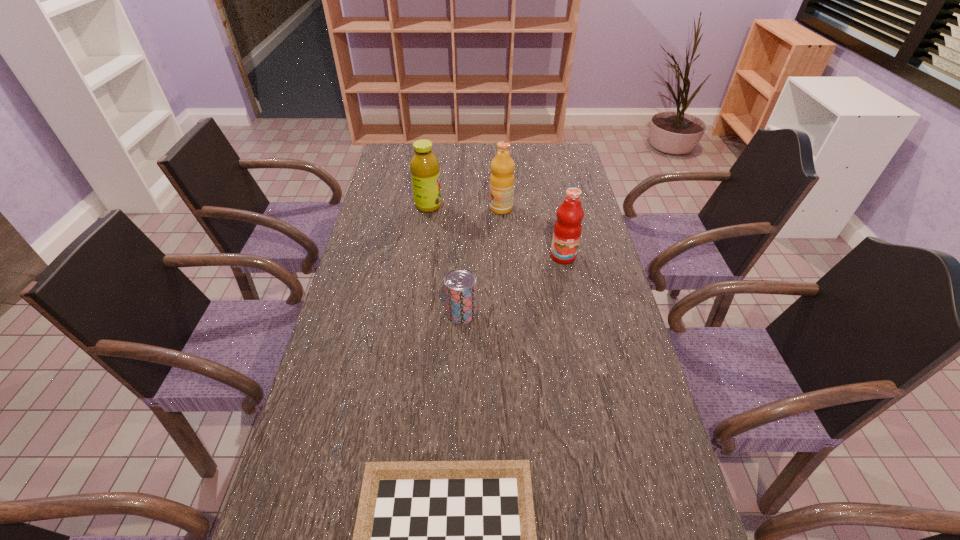
You are a GUI agent. You are given a task and a screenshot of the screen. Output one action in this format:
    pyautogui.click(x=<x>, y=<y>)
    Task: Click on the free spot located 0.270m on the front label of the rightmost object
    
    Given the screenshot: What is the action you would take?
    pyautogui.click(x=579, y=334)

Find the location of a particular element. free location located on the left of the beer can is located at coordinates (346, 313).

At what (x,y) coordinates should I click in order to perform the action: click on object that is at the left edge. Please return your answer as a coordinate pair (x, y). This screenshot has height=540, width=960. Looking at the image, I should click on (424, 165).

Find the location of a particular element. object positioned at the right edge is located at coordinates (567, 230).

The width and height of the screenshot is (960, 540). Find the location of `vacant space at the far edge of the desktop`. vacant space at the far edge of the desktop is located at coordinates (526, 155).

Locate an element on the screen. free spot at the left edge of the desktop is located at coordinates (392, 314).

The height and width of the screenshot is (540, 960). In the image, there is a desktop. In order to click on vacant space at the right edge in this screenshot , I will do `click(586, 202)`.

In the image, there is a desktop. What are the coordinates of `vacant space at the far left corner` in the screenshot? It's located at (392, 159).

Locate an element on the screen. This screenshot has height=540, width=960. vacant space that is in between the beer can and the third nearest object is located at coordinates (513, 285).

Where is `blank region between the second fruit juice from left to right and the beer can`? The image size is (960, 540). blank region between the second fruit juice from left to right and the beer can is located at coordinates (481, 261).